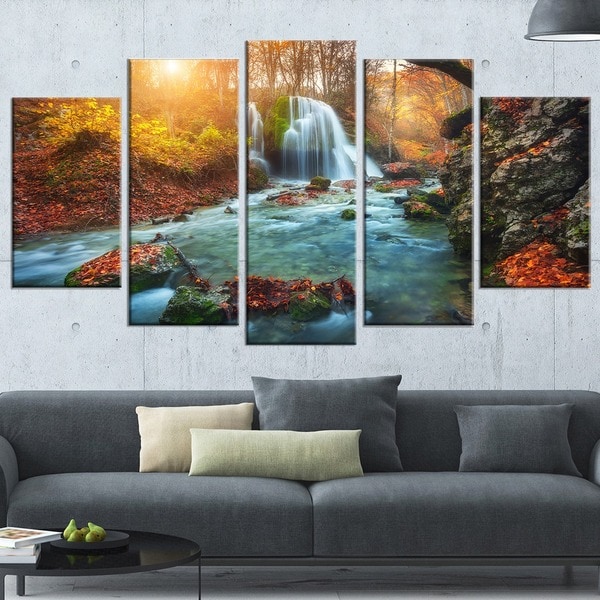
Locate an element on the screen. books is located at coordinates pyautogui.click(x=21, y=537).